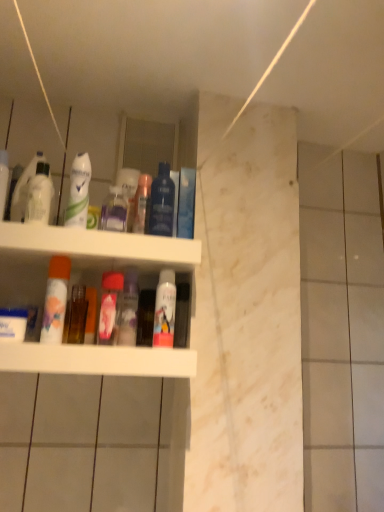
Question: Can you confirm if pink matte spray can at center, acting as the third toiletry starting from the right, is bigger than white glossy deodorant at upper left, acting as the second cleaning product starting from the back?

Choices:
 (A) yes
 (B) no

Answer: (B)

Question: Is pink matte spray can at center, acting as the third toiletry starting from the right, positioned with its back to white glossy deodorant at upper left, which ranks as the first cleaning product in left-to-right order?

Choices:
 (A) yes
 (B) no

Answer: (B)

Question: Considering the relative positions of pink matte spray can at center, which is the first toiletry in left-to-right order, and white glossy deodorant at upper left, marked as the 1th cleaning product in a front-to-back arrangement, in the image provided, is pink matte spray can at center, which is the first toiletry in left-to-right order, to the right of white glossy deodorant at upper left, marked as the 1th cleaning product in a front-to-back arrangement, from the viewer's perspective?

Choices:
 (A) no
 (B) yes

Answer: (B)

Question: From the image's perspective, would you say pink matte spray can at center, acting as the third toiletry starting from the right, is shown under white glossy deodorant at upper left, the 2th cleaning product in the right-to-left sequence?

Choices:
 (A) no
 (B) yes

Answer: (B)

Question: Is pink matte spray can at center, which is the first toiletry in left-to-right order, smaller than white glossy deodorant at upper left, marked as the 1th cleaning product in a front-to-back arrangement?

Choices:
 (A) yes
 (B) no

Answer: (A)

Question: Is blue glossy mouthwash at upper center, acting as the 4th mouthwash starting from the left, to the left or to the right of white plastic shelf at center in the image?

Choices:
 (A) right
 (B) left

Answer: (A)

Question: Does point (165, 216) appear closer or farther from the camera than point (192, 246)?

Choices:
 (A) closer
 (B) farther

Answer: (A)

Question: From their relative heights in the image, would you say blue glossy mouthwash at upper center, acting as the 4th mouthwash starting from the left, is taller or shorter than white plastic shelf at center?

Choices:
 (A) short
 (B) tall

Answer: (A)

Question: Relative to white plastic shelf at center, is blue glossy mouthwash at upper center, the 2th mouthwash positioned from the right, in front or behind?

Choices:
 (A) behind
 (B) front

Answer: (A)

Question: In terms of height, does blue glossy mouthwash at upper center, acting as the 4th mouthwash starting from the left, look taller or shorter compared to pink matte spray can at center, which is the first toiletry in left-to-right order?

Choices:
 (A) tall
 (B) short

Answer: (A)

Question: Does point (165, 232) appear closer or farther from the camera than point (129, 334)?

Choices:
 (A) closer
 (B) farther

Answer: (A)

Question: From the image's perspective, relative to pink matte spray can at center, acting as the third toiletry starting from the right, is blue glossy mouthwash at upper center, acting as the 4th mouthwash starting from the left, above or below?

Choices:
 (A) below
 (B) above

Answer: (B)

Question: Is blue glossy mouthwash at upper center, acting as the 4th mouthwash starting from the left, inside the boundaries of pink matte spray can at center, which is the first toiletry in left-to-right order, or outside?

Choices:
 (A) inside
 (B) outside

Answer: (B)

Question: Considering the relative positions of white matte mouthwash at center, which ranks as the fifth mouthwash in left-to-right order, and white glossy deodorant at upper left, which ranks as the first cleaning product in left-to-right order, in the image provided, is white matte mouthwash at center, which ranks as the fifth mouthwash in left-to-right order, to the left or to the right of white glossy deodorant at upper left, which ranks as the first cleaning product in left-to-right order,?

Choices:
 (A) left
 (B) right

Answer: (B)

Question: Relative to white glossy deodorant at upper left, marked as the 1th cleaning product in a front-to-back arrangement, is white matte mouthwash at center, which ranks as the fifth mouthwash in left-to-right order, in front or behind?

Choices:
 (A) front
 (B) behind

Answer: (B)